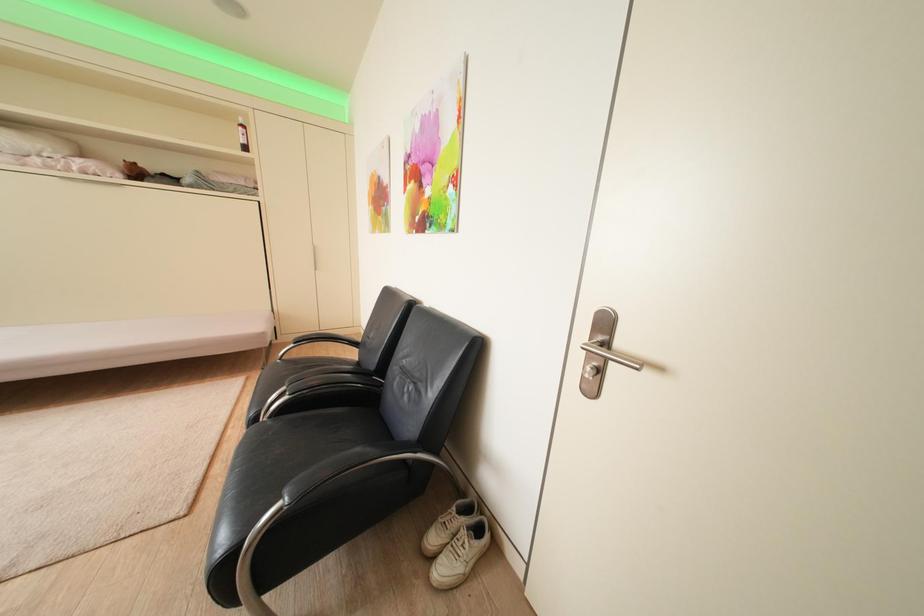
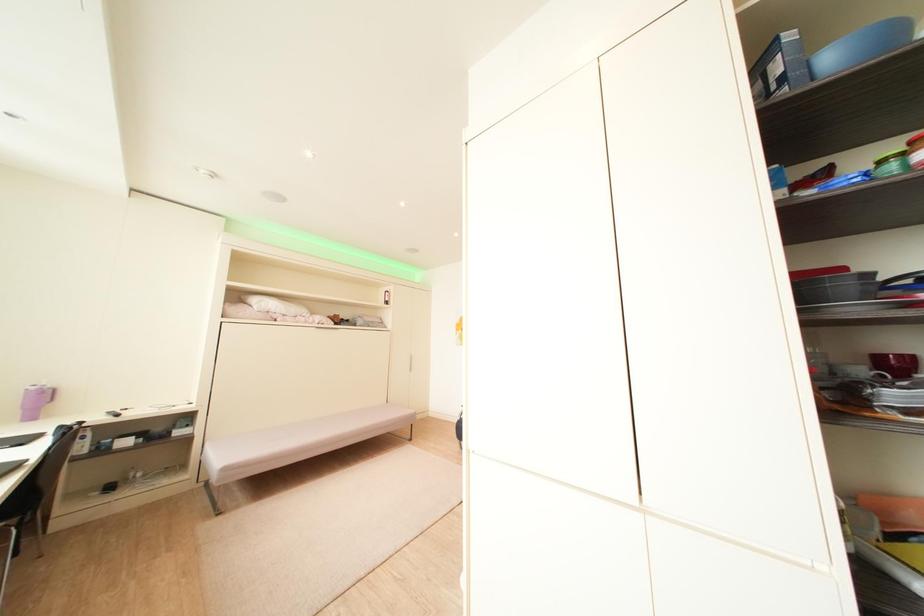
Based on the photo, which direction would the cameraman need to move to produce the second image?

The movement direction of the cameraman is left, backward.